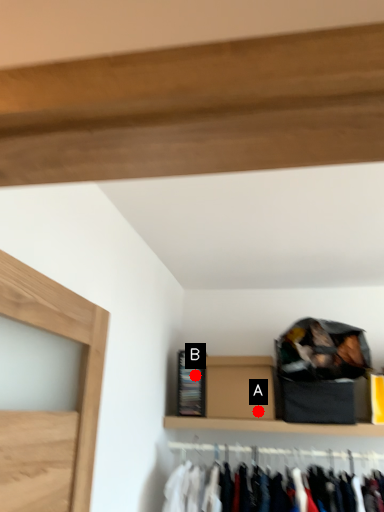
Question: Two points are circled on the image, labeled by A and B beside each circle. Which point is closer to the camera taking this photo?

Choices:
 (A) A is closer
 (B) B is closer

Answer: (A)